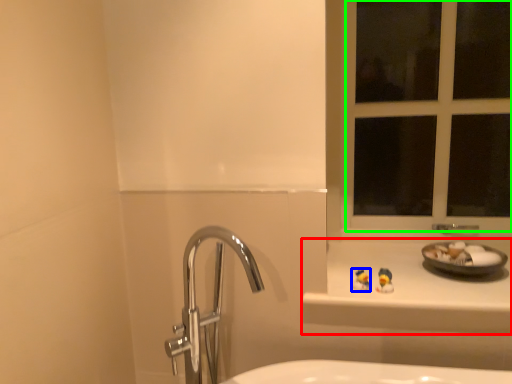
Question: Which is nearer to the counter top (highlighted by a red box)? miniature (highlighted by a blue box) or window frame (highlighted by a green box).

Choices:
 (A) miniature
 (B) window frame

Answer: (A)